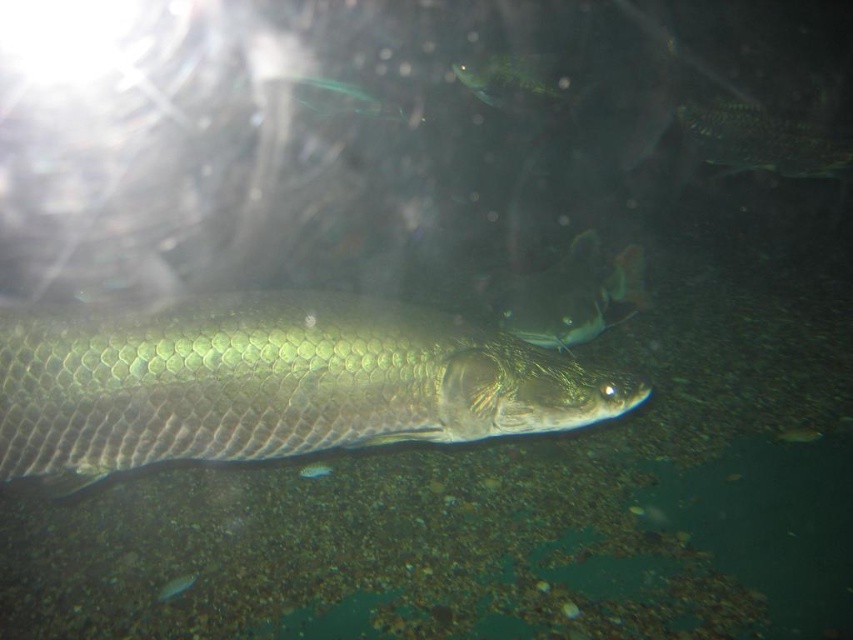
Question: In this image, where is shiny green fish at upper center located relative to green shiny fish at upper center?

Choices:
 (A) left
 (B) right

Answer: (B)

Question: Which point is farther from the camera taking this photo?

Choices:
 (A) (553, 90)
 (B) (302, 353)
 (C) (564, 292)

Answer: (A)

Question: Estimate the real-world distances between objects in this image. Which object is farther from the green scaly fish at center?

Choices:
 (A) shiny silver fish at lower left
 (B) green shiny fish at upper center

Answer: (B)

Question: Does green scaly fish at center have a greater width compared to shiny silver fish at lower left?

Choices:
 (A) yes
 (B) no

Answer: (A)

Question: Which of the following is the closest to the observer?

Choices:
 (A) (527, 296)
 (B) (164, 589)
 (C) (218, 392)
 (D) (322, 88)

Answer: (C)

Question: Is shiny green fish at upper center wider than shiny silver fish at lower left?

Choices:
 (A) yes
 (B) no

Answer: (A)